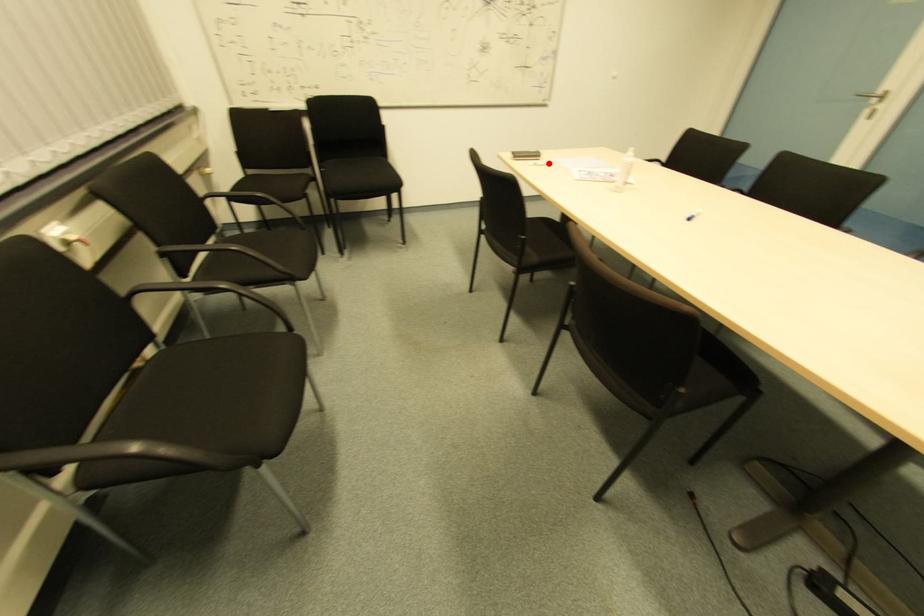
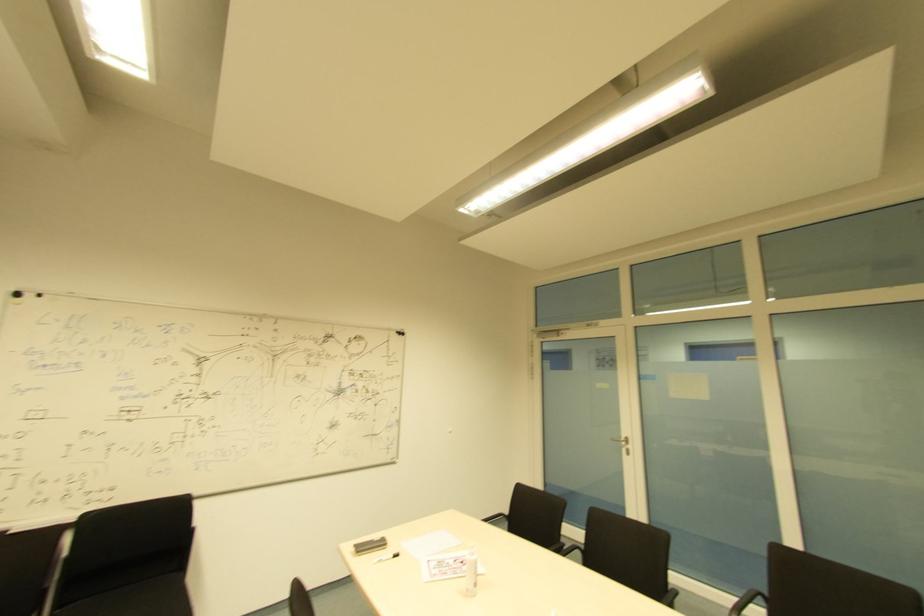
Where in the second image is the point corresponding to the highlighted location from the first image?

(394, 554)